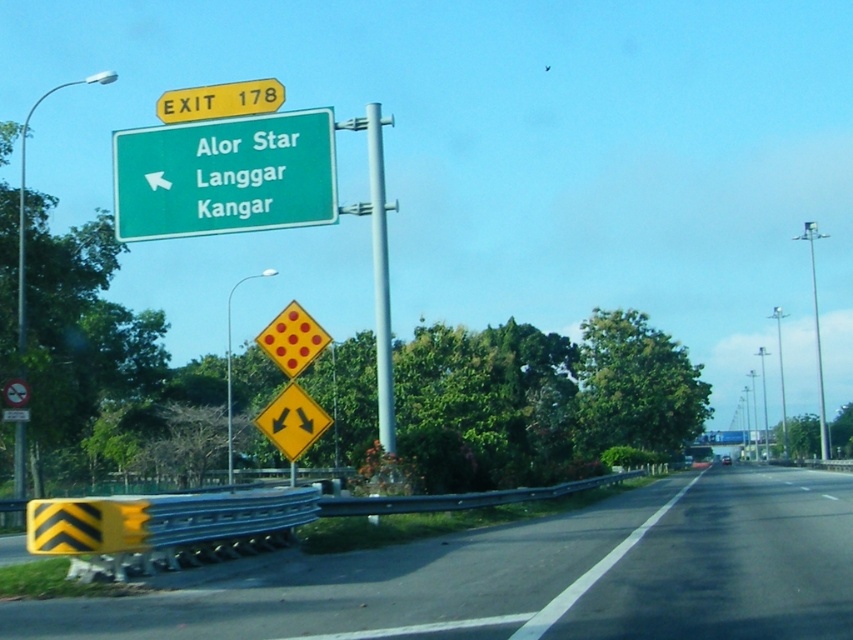
Question: Which of the following is the closest to the observer?

Choices:
 (A) (279, 403)
 (B) (248, 188)

Answer: (A)

Question: Does silver metallic pole at center appear over yellow matte exit sign at upper center?

Choices:
 (A) yes
 (B) no

Answer: (A)

Question: Does yellow reflective plastic guardrail at lower left have a larger size compared to yellow matte exit sign at upper center?

Choices:
 (A) yes
 (B) no

Answer: (A)

Question: Is silver metallic pole at center further to camera compared to yellow reflective diamond at center?

Choices:
 (A) no
 (B) yes

Answer: (B)

Question: Which object appears closest to the camera in this image?

Choices:
 (A) yellow reflective diamond at upper left
 (B) silver metallic pole at center
 (C) yellow reflective diamond at center

Answer: (C)

Question: Which is nearer to the yellow reflective diamond at upper left?

Choices:
 (A) yellow matte exit sign at upper center
 (B) silver metallic pole at center

Answer: (A)